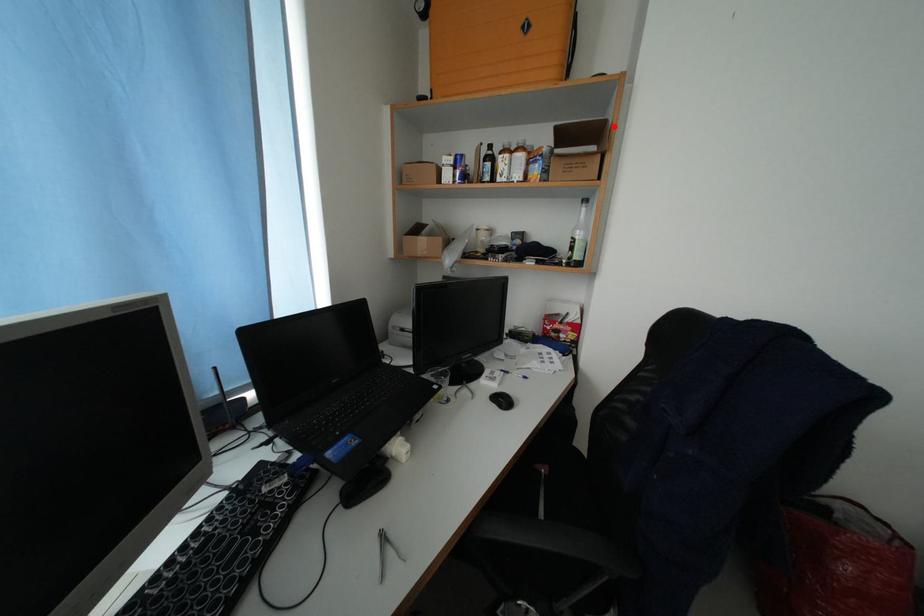
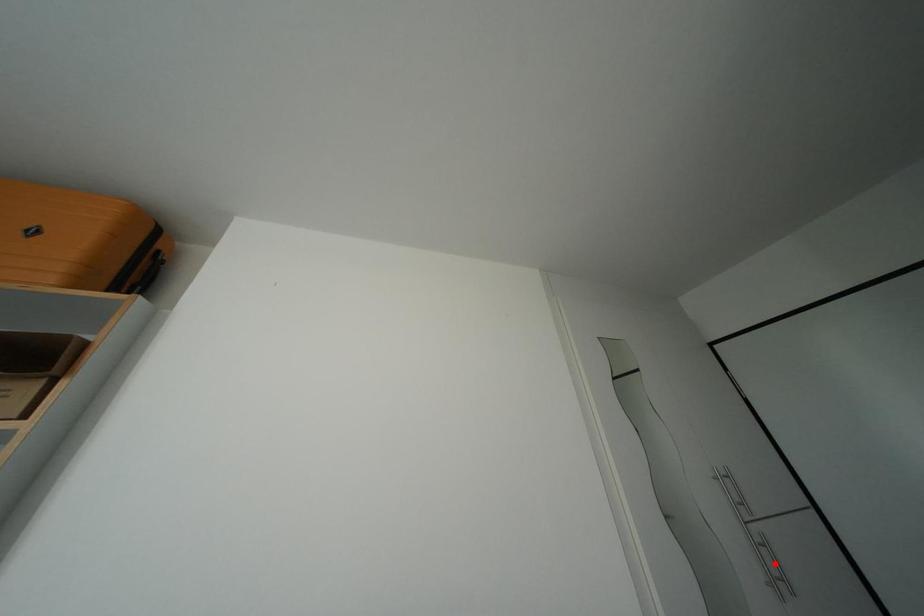
I am providing you with two images of the same scene from different viewpoints. A red point is marked on the first image and another point is marked on the second image. Is the red point in image1 aligned with the point shown in image2?

No